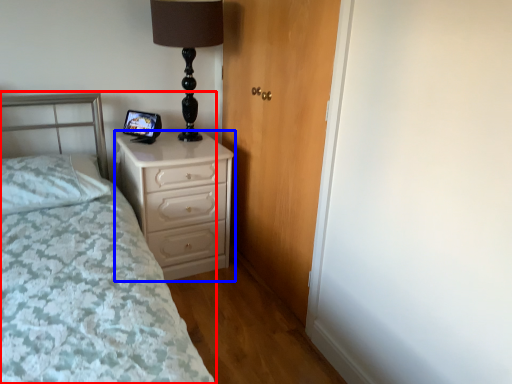
Question: Which object appears farthest to the camera in this image, bed (highlighted by a red box) or chest of drawers (highlighted by a blue box)?

Choices:
 (A) bed
 (B) chest of drawers

Answer: (B)